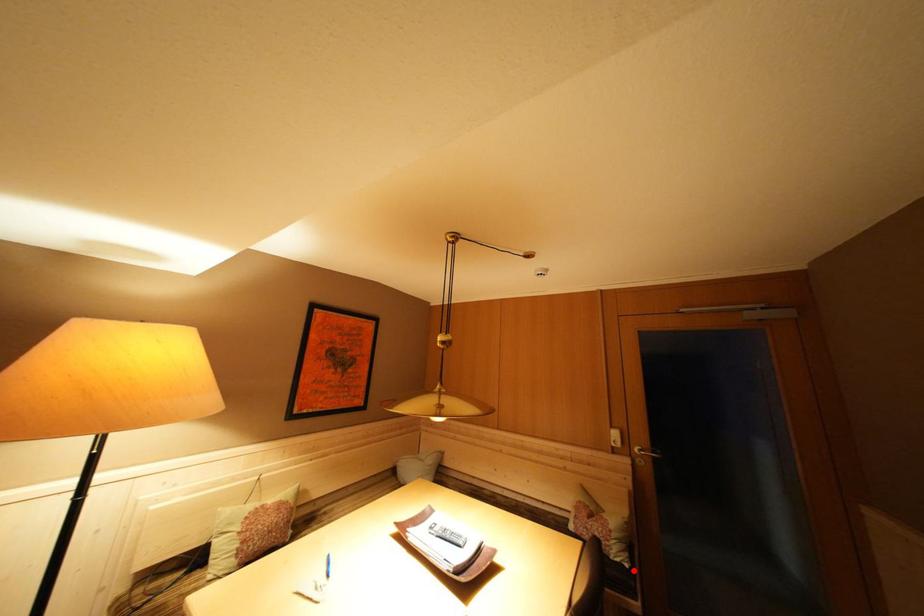
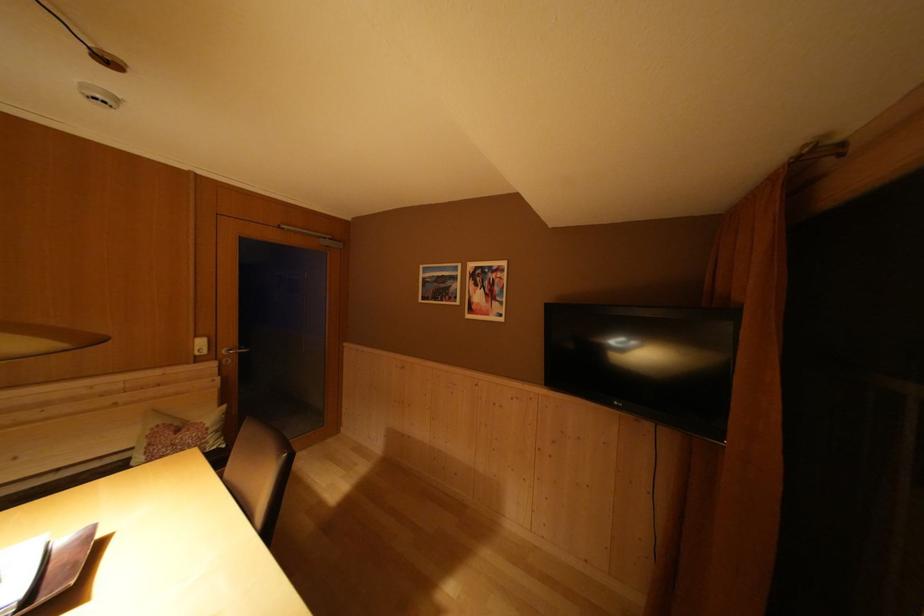
In the second image, find the point that corresponds to the highlighted location in the first image.

(231, 451)